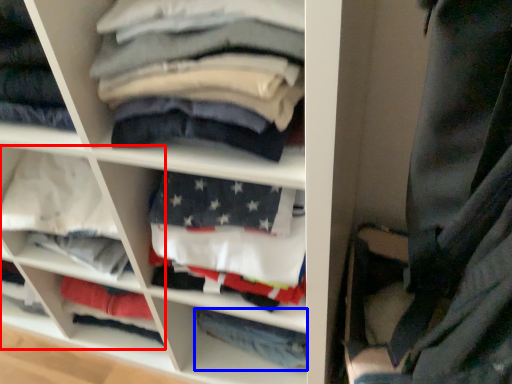
Question: Which object appears closest to the camera in this image, cabinet (highlighted by a red box) or trousers (highlighted by a blue box)?

Choices:
 (A) cabinet
 (B) trousers

Answer: (A)